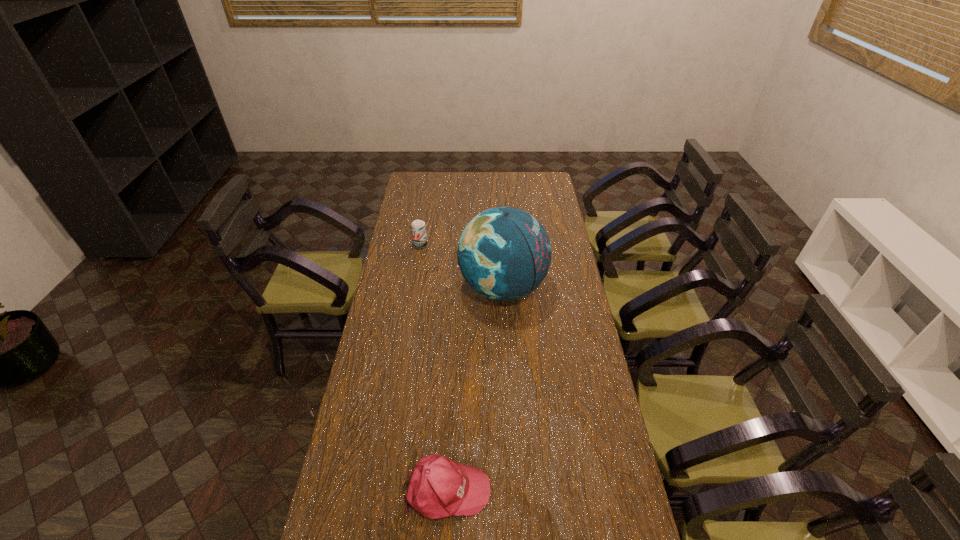
The width and height of the screenshot is (960, 540). I want to click on the second closest object to the tallest object, so click(438, 487).

Where is `free spot that satisfies the following two spatial constraints: 1. on the front side of the tallest object; 2. at the front of the baseball cap with the brim`? The image size is (960, 540). free spot that satisfies the following two spatial constraints: 1. on the front side of the tallest object; 2. at the front of the baseball cap with the brim is located at coordinates (514, 489).